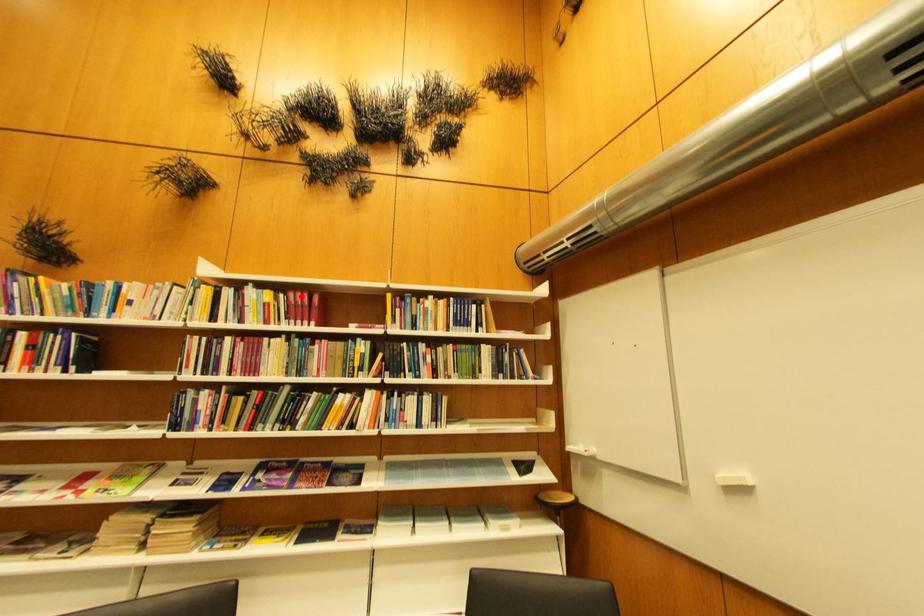
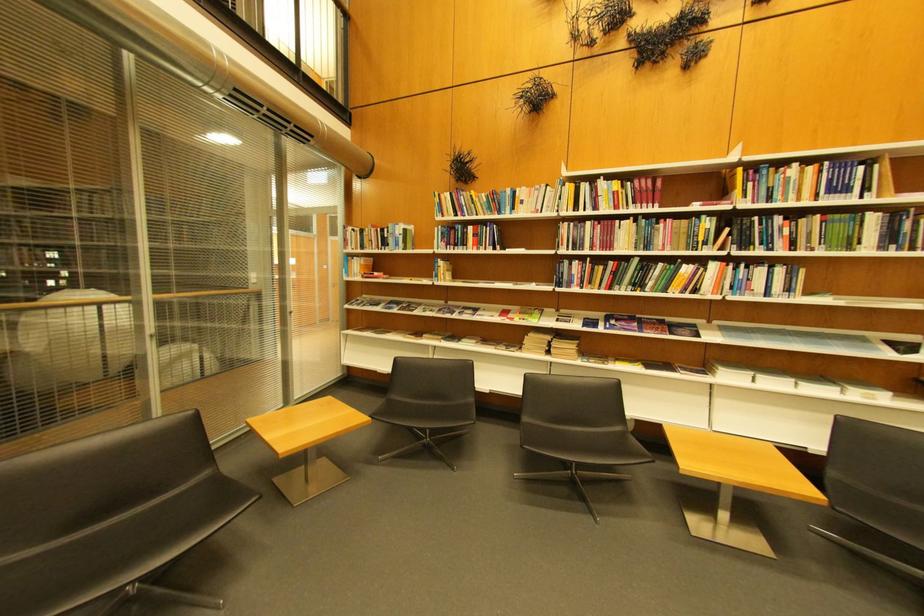
Question: A red point is marked in image1. In image2, is the corresponding 3D point closer to the camera or farther? Reply with the corresponding letter.

Choices:
 (A) The corresponding 3D point is closer.
 (B) The corresponding 3D point is farther.

Answer: (A)